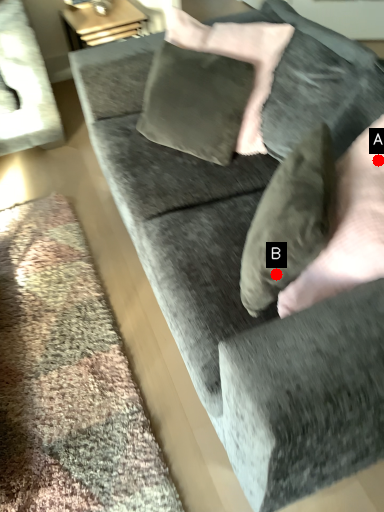
Question: Two points are circled on the image, labeled by A and B beside each circle. Which point is farther to the camera?

Choices:
 (A) A is further
 (B) B is further

Answer: (A)